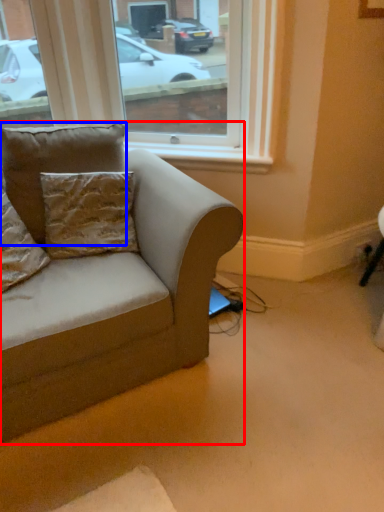
Question: Which of the following is the closest to the observer, studio couch (highlighted by a red box) or pillow (highlighted by a blue box)?

Choices:
 (A) studio couch
 (B) pillow

Answer: (A)